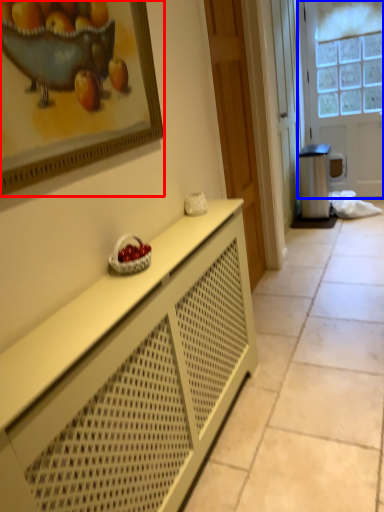
Question: Among these objects, which one is nearest to the camera, picture frame (highlighted by a red box) or door (highlighted by a blue box)?

Choices:
 (A) picture frame
 (B) door

Answer: (A)